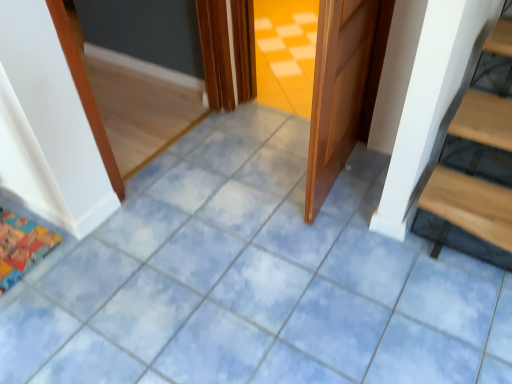
In order to click on vacant space in between brown wooden door at center and cartoon fabric mat at lower left in this screenshot , I will do `click(203, 209)`.